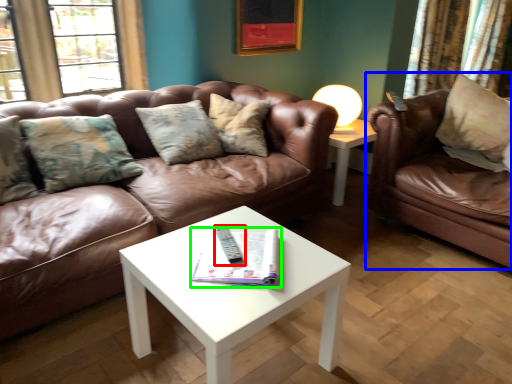
Question: Based on their relative distances, which object is nearer to remote (highlighted by a red box)? Choose from studio couch (highlighted by a blue box) and magazine (highlighted by a green box).

Choices:
 (A) studio couch
 (B) magazine

Answer: (B)